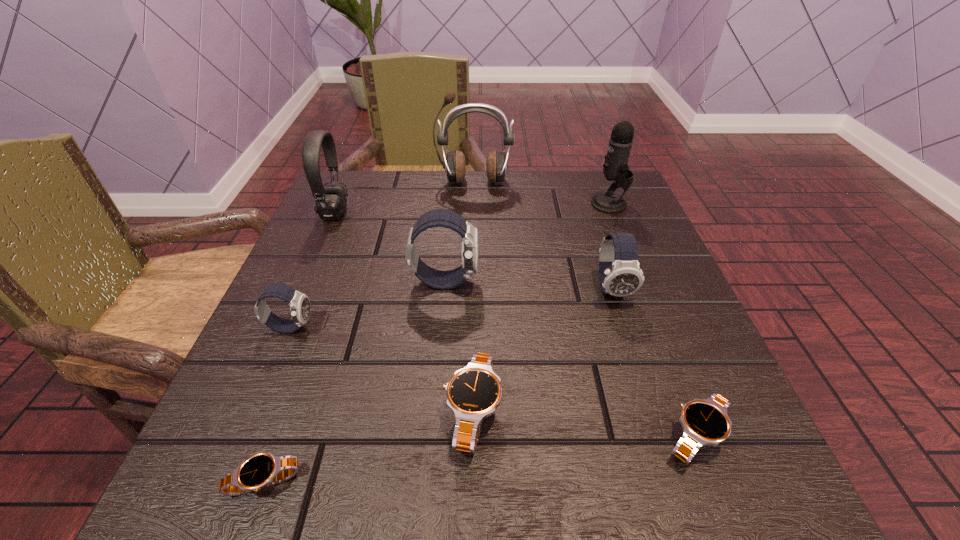
At what (x,y) coordinates should I click in order to perform the action: click on the seventh tallest object. Please return your answer as a coordinate pair (x, y). Looking at the image, I should click on (473, 393).

Where is `the second black watch from right to left`? the second black watch from right to left is located at coordinates (473, 393).

Locate an element on the screen. The width and height of the screenshot is (960, 540). the rightmost black watch is located at coordinates (705, 421).

Locate an element on the screen. The width and height of the screenshot is (960, 540). the eighth tallest object is located at coordinates pyautogui.click(x=705, y=421).

This screenshot has width=960, height=540. I want to click on the shortest object, so click(x=263, y=469).

Find the location of a particular element. the leftmost black watch is located at coordinates (263, 469).

Find the location of a particular element. vacant region located 0.250m on the ear pads of the brown earphone is located at coordinates click(x=472, y=255).

Find the location of a particular element. Image resolution: width=960 pixels, height=540 pixels. free spot located 0.090m on the left of the microphone is located at coordinates (553, 204).

Locate an element on the screen. The image size is (960, 540). vacant space located 0.070m on the front-facing side of the headset is located at coordinates (378, 213).

At what (x,y) coordinates should I click in order to perform the action: click on vacant space situated 0.170m on the face of the biggest dark watch. Please return your answer as a coordinate pair (x, y). Looking at the image, I should click on (569, 281).